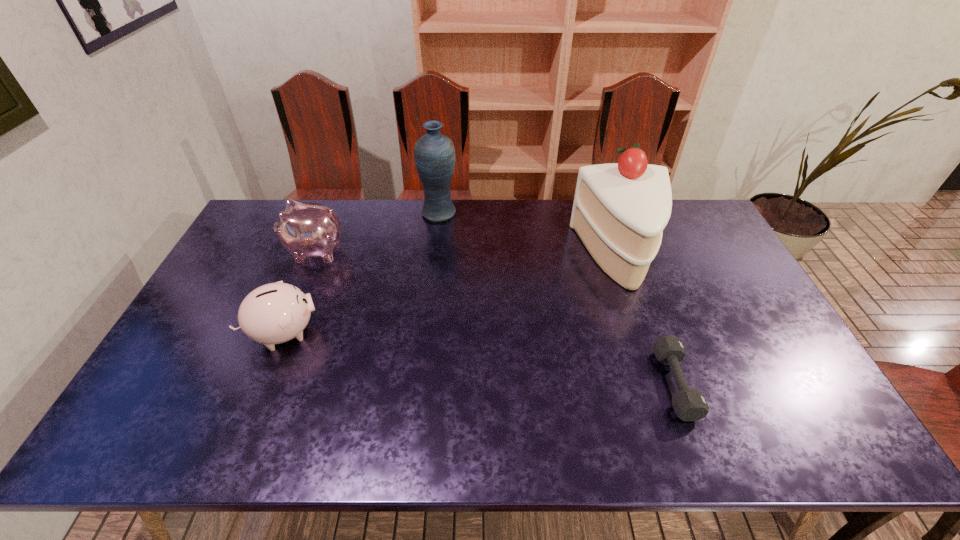
In order to click on the third object from right to left in this screenshot , I will do `click(434, 153)`.

The image size is (960, 540). I want to click on vase, so click(x=434, y=153).

The height and width of the screenshot is (540, 960). I want to click on cake, so click(619, 212).

This screenshot has width=960, height=540. I want to click on the farther piggy bank, so click(306, 230).

The width and height of the screenshot is (960, 540). I want to click on the nearer piggy bank, so [x=274, y=313].

Where is `the shortest object`? the shortest object is located at coordinates (689, 404).

Find the location of a particular element. The height and width of the screenshot is (540, 960). vacant space located on the left of the farthest object is located at coordinates (331, 213).

Locate an element on the screen. The height and width of the screenshot is (540, 960). vacant region located 0.340m on the left of the cake is located at coordinates (473, 256).

Find the location of a particular element. vacant space positioned on the front facing side of the farther piggy bank is located at coordinates (236, 251).

Identify the location of free space located on the front facing side of the farther piggy bank. The image size is (960, 540). (266, 251).